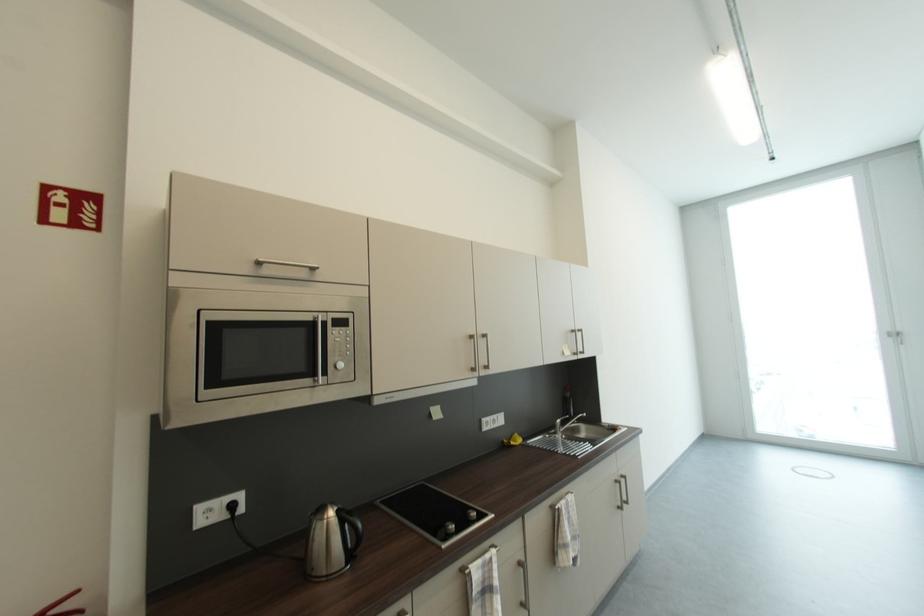
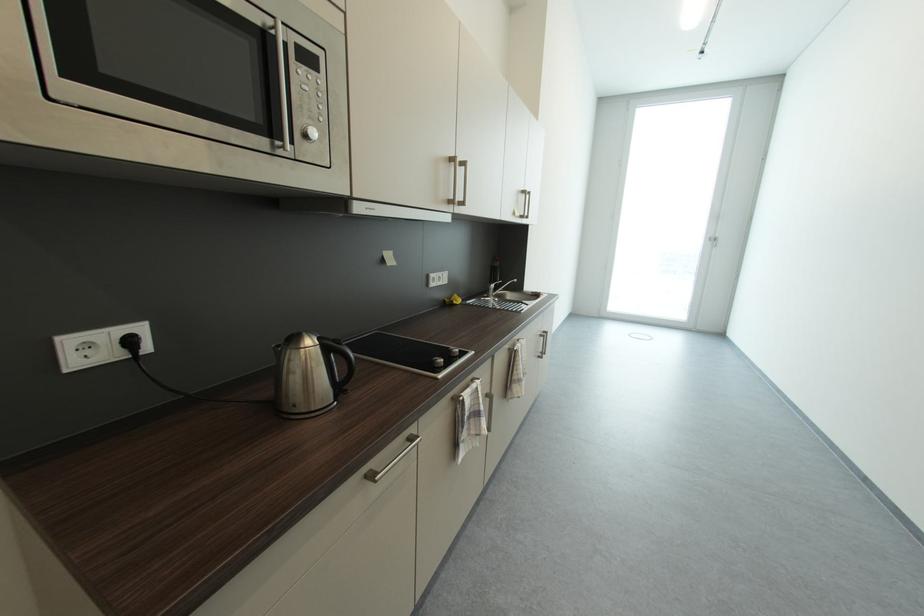
Question: I am providing you with two images of the same scene from different viewpoints. Please identify which objects are invisible in image2.

Choices:
 (A) black electrical plug
 (B) white door handle
 (C) faucet handle
 (D) none of these

Answer: (D)